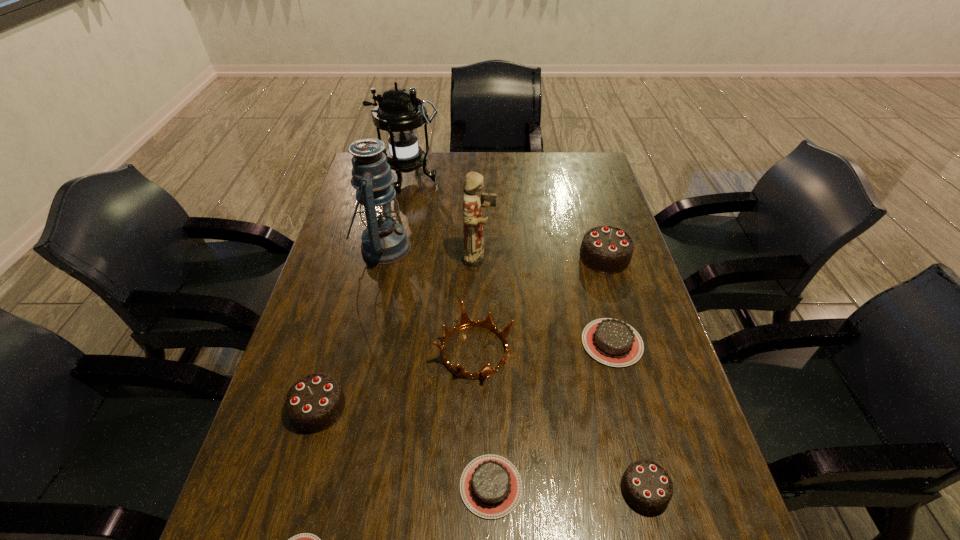
This screenshot has height=540, width=960. I want to click on chocolate chocolate cake that stands as the closest to the fourth tallest object, so click(x=646, y=485).

Identify which chocolate chocolate cake is located as the third nearest to the gold crown. Please provide its 2D coordinates. Your answer should be formatted as a tuple, i.e. [(x, y)], where the tuple contains the x and y coordinates of a point satisfying the conditions above.

[(605, 249)]

Point out which brown chocolate cake is positioned as the third nearest to the figurine. Please provide its 2D coordinates. Your answer should be formatted as a tuple, i.e. [(x, y)], where the tuple contains the x and y coordinates of a point satisfying the conditions above.

[(305, 539)]

Locate which brown chocolate cake is the third closest to the eighth shortest object. Please provide its 2D coordinates. Your answer should be formatted as a tuple, i.e. [(x, y)], where the tuple contains the x and y coordinates of a point satisfying the conditions above.

[(305, 539)]

Locate an element on the screen. The height and width of the screenshot is (540, 960). vacant point that satisfies the following two spatial constraints: 1. on the back side of the nearest chocolate chocolate cake; 2. on the left side of the farthest chocolate chocolate cake is located at coordinates tap(586, 257).

Locate an element on the screen. free point that satisfies the following two spatial constraints: 1. on the front side of the farthest object; 2. on the left side of the fourth tallest chocolate cake is located at coordinates (374, 342).

Identify the location of vacant region that satisfies the following two spatial constraints: 1. on the front-facing side of the smallest chocolate chocolate cake; 2. on the right side of the nearer lantern. (326, 489).

The image size is (960, 540). In order to click on free location that satisfies the following two spatial constraints: 1. on the front-facing side of the nearer lantern; 2. on the left side of the smallest chocolate chocolate cake in this screenshot , I will do `click(326, 489)`.

Identify the location of free space that satisfies the following two spatial constraints: 1. on the front-facing side of the ninth tallest object; 2. on the right side of the eighth shortest object. This screenshot has width=960, height=540. (480, 486).

At what (x,y) coordinates should I click in order to perform the action: click on free location that satisfies the following two spatial constraints: 1. on the front side of the farther lantern; 2. on the front-facing side of the nearer lantern. Please return your answer as a coordinate pair (x, y). The width and height of the screenshot is (960, 540). Looking at the image, I should click on (394, 247).